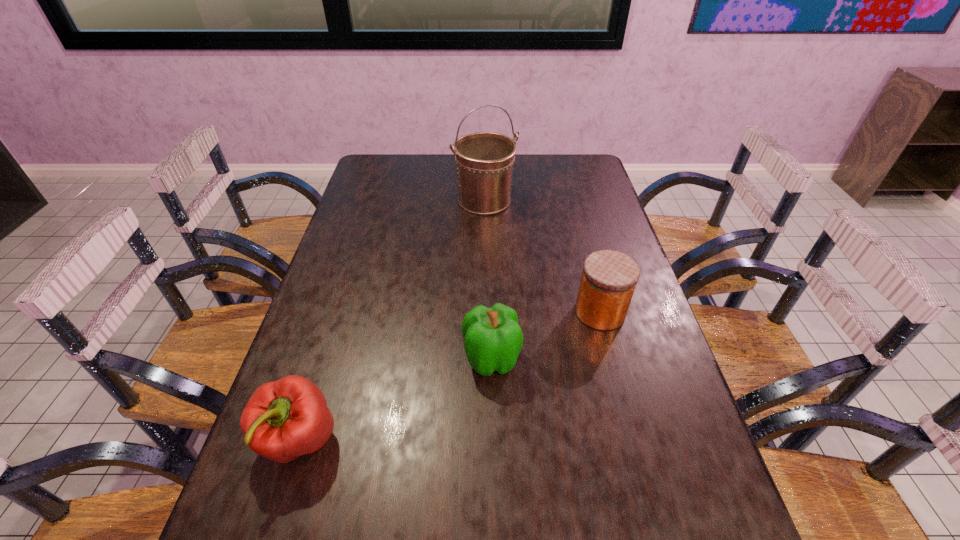
Locate an element on the screen. The width and height of the screenshot is (960, 540). the farthest object is located at coordinates (484, 160).

Find the location of a particular element. bucket is located at coordinates (484, 160).

Locate an element on the screen. the third farthest object is located at coordinates (493, 339).

You are a GUI agent. You are given a task and a screenshot of the screen. Output one action in this format:
    pyautogui.click(x=<x>, y=<y>)
    Task: Click on the farther bell pepper
    The image size is (960, 540).
    Given the screenshot: What is the action you would take?
    pyautogui.click(x=493, y=339)

What are the coordinates of `the third nearest object` in the screenshot? It's located at pos(609,278).

Find the location of a particular element. jar is located at coordinates (609, 278).

Locate an element on the screen. This screenshot has width=960, height=540. the leftmost object is located at coordinates (284, 419).

Image resolution: width=960 pixels, height=540 pixels. Find the location of `the nearest object`. the nearest object is located at coordinates (284, 419).

The width and height of the screenshot is (960, 540). In order to click on free location located 0.270m on the left of the farthest object in this screenshot , I will do `click(376, 200)`.

Image resolution: width=960 pixels, height=540 pixels. I want to click on free region located 0.220m on the back of the farther bell pepper, so click(490, 278).